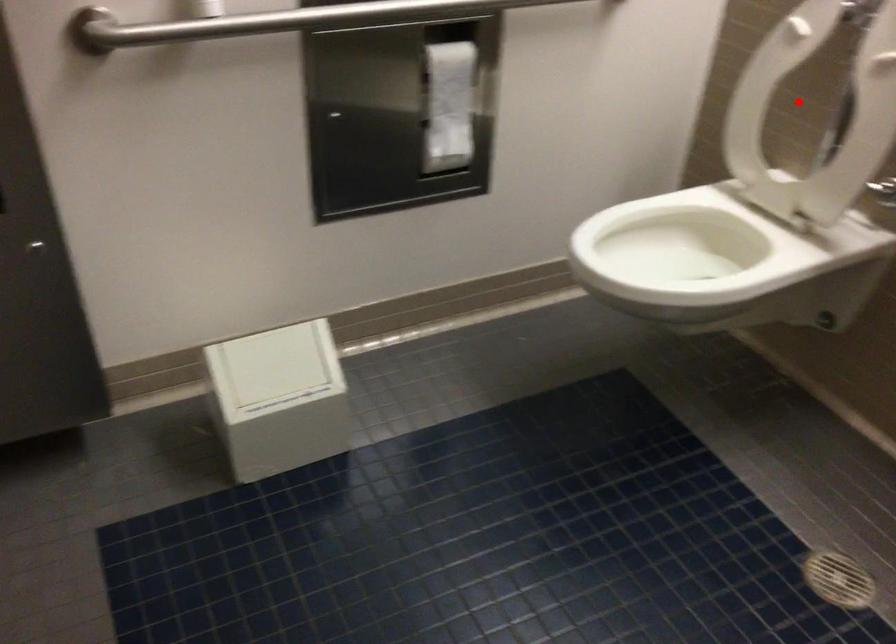
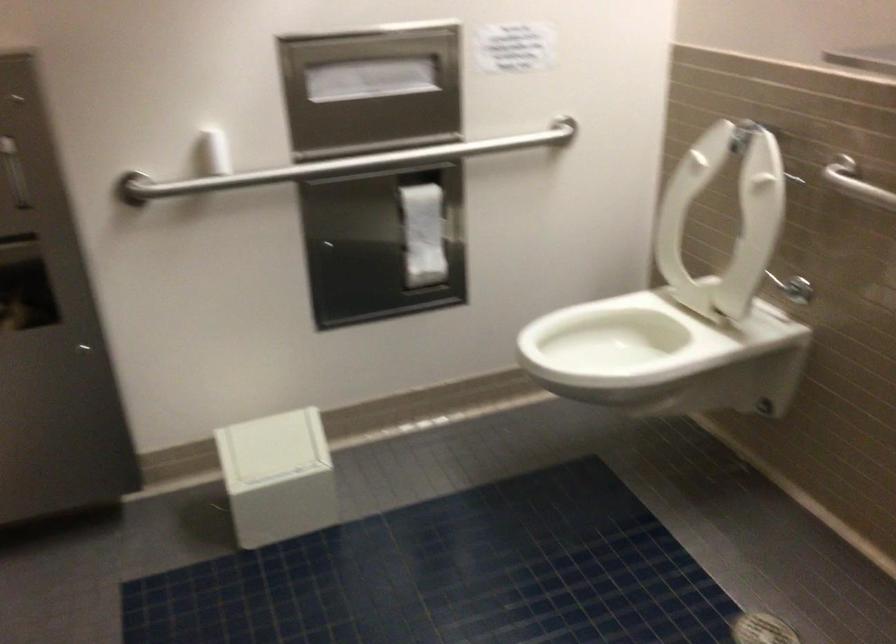
Find the pixel in the second image that matches the highlighted location in the first image.

(724, 219)